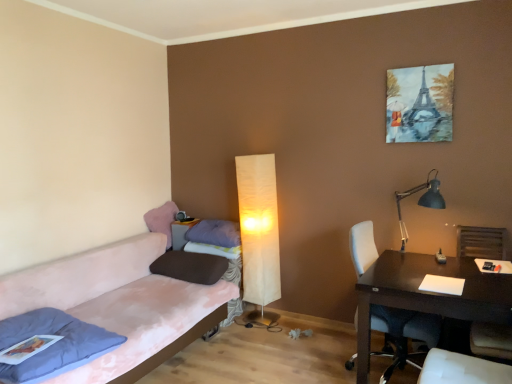
This screenshot has width=512, height=384. I want to click on free space in front of matte cream floor lamp at center, which ranks as the 1th lamp in back-to-front order, so coord(252,334).